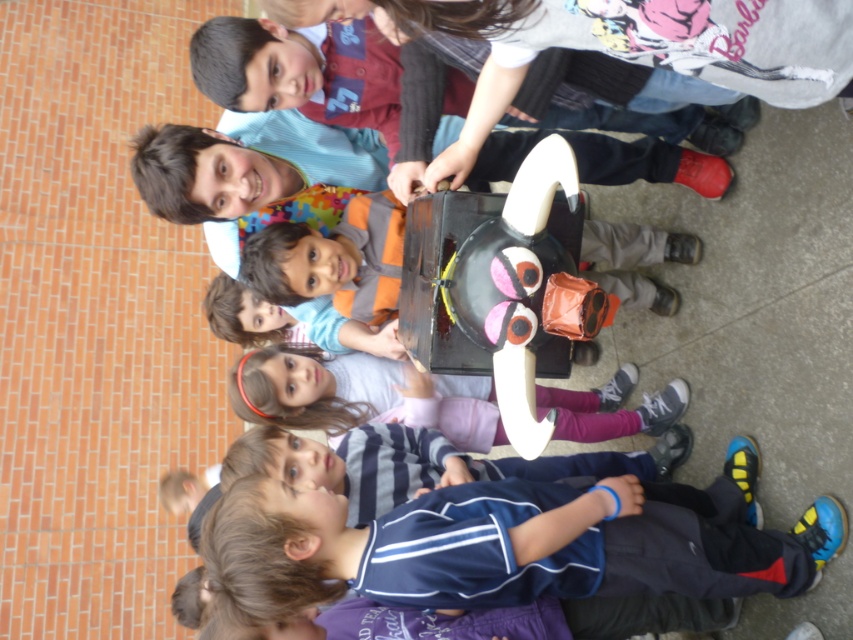
You are a photographer trying to capture a photo of the matte orange shirt at center and the pink fabric dress at center. Since you want both subjects to be clearly visible, which one should you focus on first to ensure the other remains in focus?

The matte orange shirt at center is above the pink fabric dress at center, so focusing on the matte orange shirt at center first would ensure the pink fabric dress at center stays in focus as it is closer to the camera.